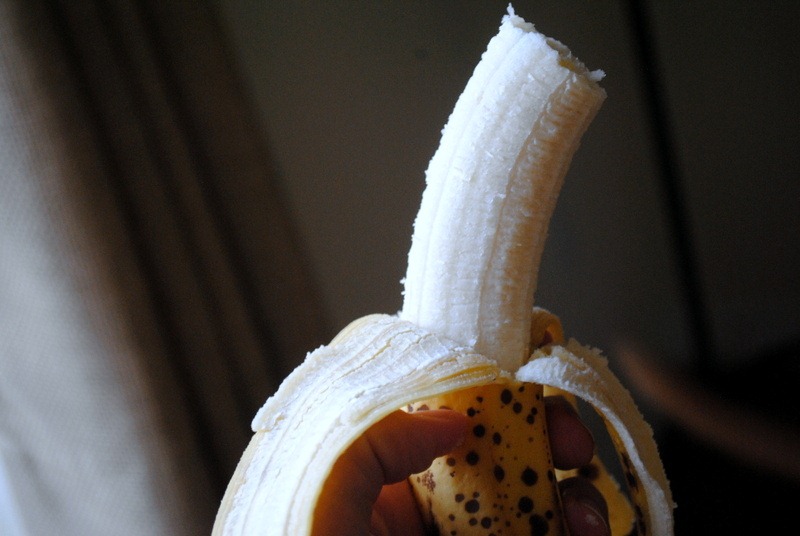
Find the location of a particular element. wall is located at coordinates (385, 140), (734, 85).